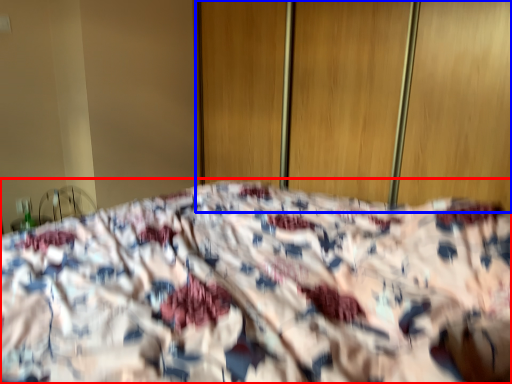
Question: Which of the following is the closest to the observer, bed (highlighted by a red box) or screen door (highlighted by a blue box)?

Choices:
 (A) bed
 (B) screen door

Answer: (A)